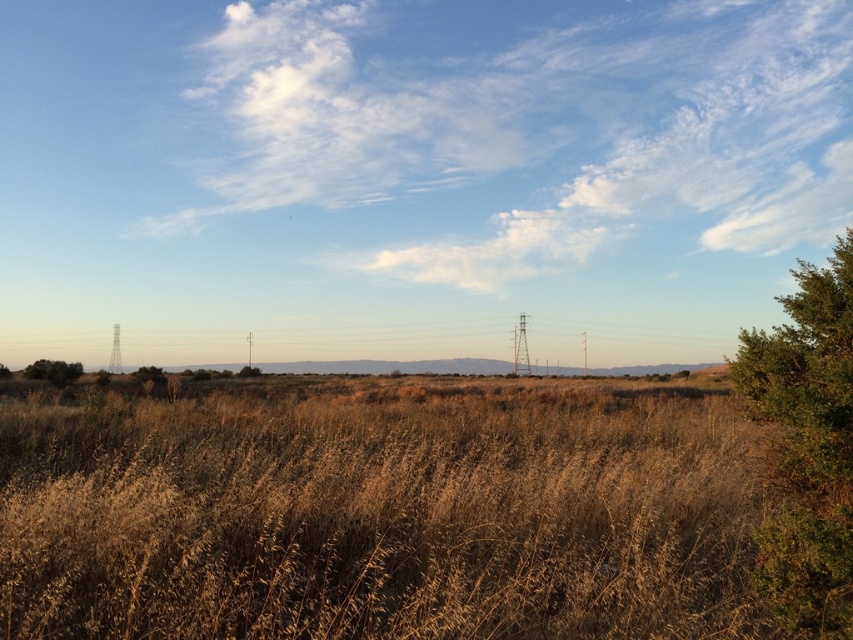
Question: Which is nearer to the brown dry grass at center?

Choices:
 (A) green leafy tree at right
 (B) green leafy bush at lower left

Answer: (A)

Question: Which of these objects is positioned farthest from the green leafy tree at right?

Choices:
 (A) brown dry grass at center
 (B) green leafy bush at lower left

Answer: (B)

Question: Which object is farther from the camera taking this photo?

Choices:
 (A) green leafy bush at lower left
 (B) brown dry grass at center

Answer: (A)

Question: Can you confirm if brown dry grass at center is wider than green leafy bush at lower left?

Choices:
 (A) yes
 (B) no

Answer: (A)

Question: Can you confirm if brown dry grass at center is thinner than green leafy tree at right?

Choices:
 (A) yes
 (B) no

Answer: (B)

Question: In this image, where is brown dry grass at center located relative to green leafy tree at right?

Choices:
 (A) above
 (B) below

Answer: (B)